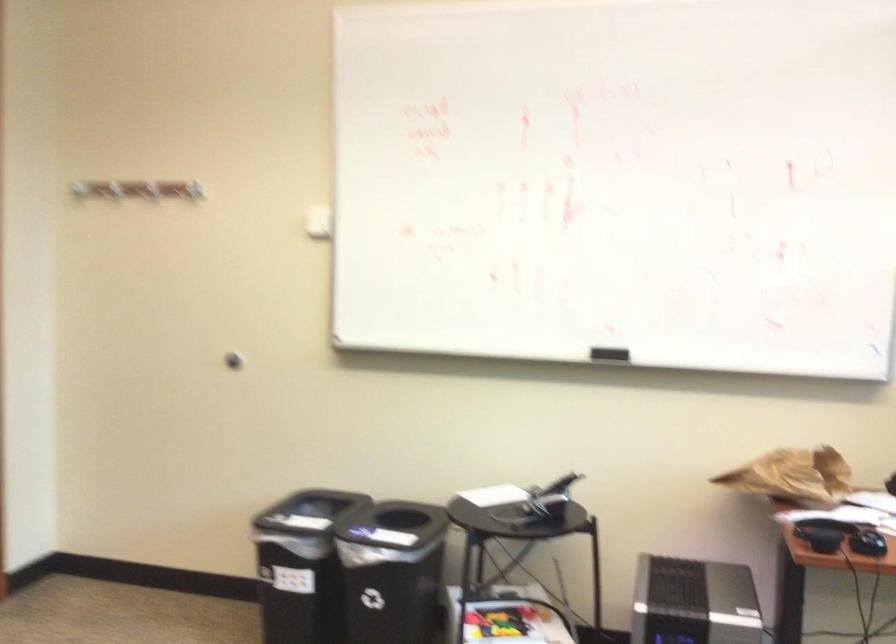
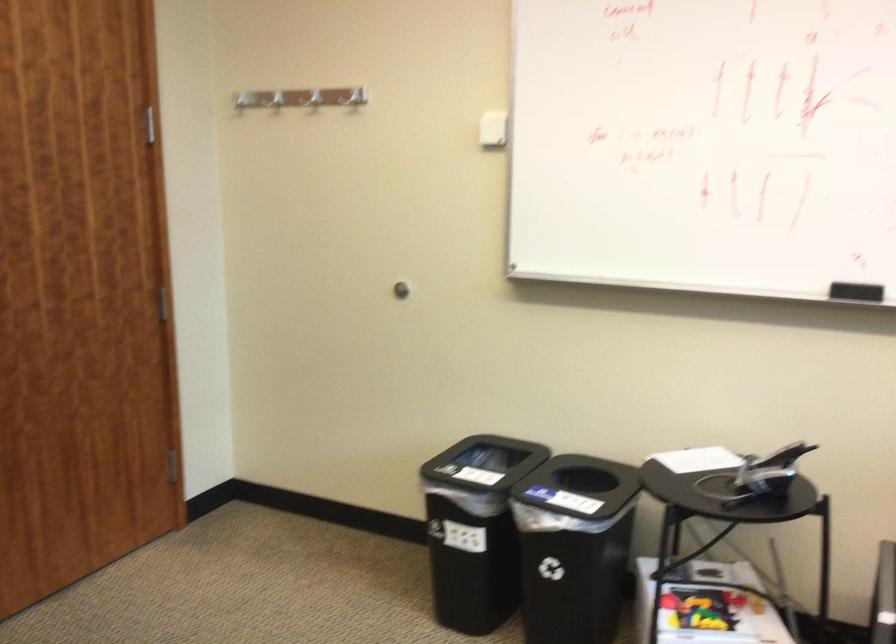
Locate, in the second image, the point that corresponds to [320,218] in the first image.

(493, 129)